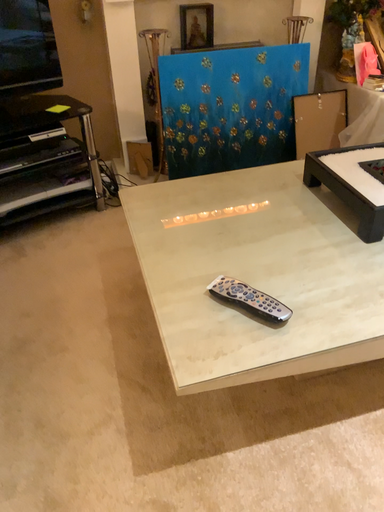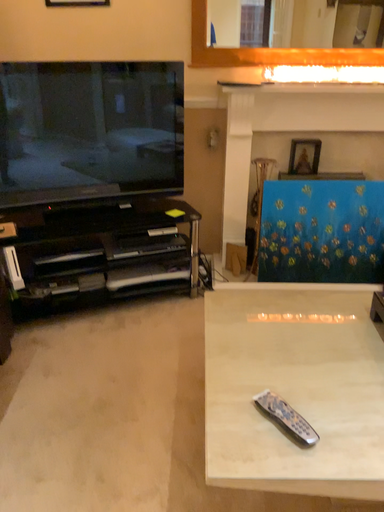
Question: How did the camera likely rotate when shooting the video?

Choices:
 (A) rotated right
 (B) rotated left

Answer: (B)